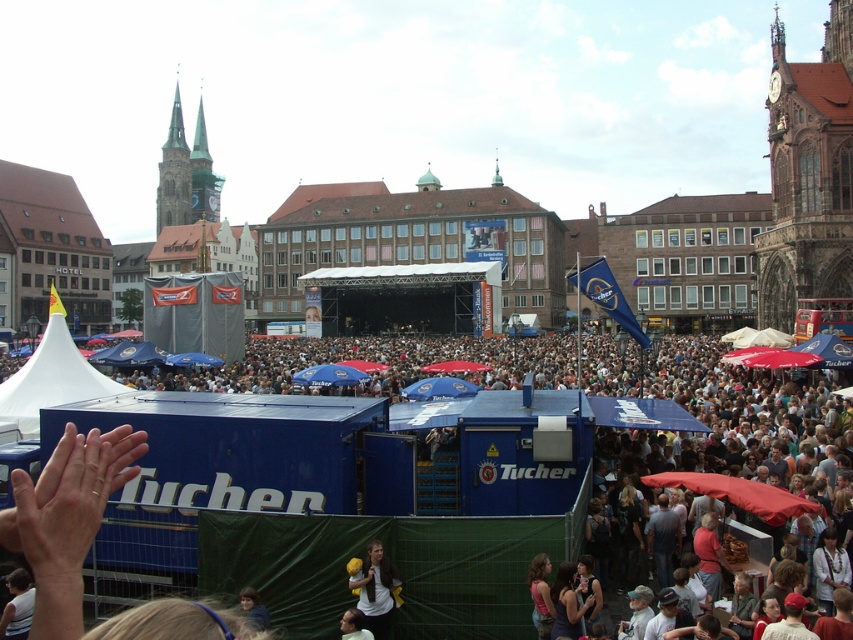
You are a photographer standing at the camera position in the town square. You want to capture a photo of the brown leather jacket at lower center. Is the distance between you and the jacket sufficient to take a clear photo with your standard zoom lens?

The distance between the photographer at the camera and the brown leather jacket at lower center is 50.07 meters. A standard zoom lens typically has a maximum effective focal length of around 200mm, which can capture clear images up to 50 meters away. Therefore, the photographer can take a clear photo of the brown leather jacket at lower center with their standard zoom lens.

You are a photographer standing at the edge of the town square, aiming to capture a wide shot of the event. You notice the brown leather jacket at lower center and the blue fabric umbrella at center. Given their distance apart, will you be able to include both in a single frame without zooming in? Explain your reasoning.

The brown leather jacket at lower center and blue fabric umbrella at center are 122.00 feet apart. Since 122 feet is a considerable distance, it is likely possible to fit both in a single frame without zooming in, provided the photographer uses a wide enough lens to capture the entire scene.

You are a photographer trying to capture a group photo of attendees at the event. You notice a brown leather jacket at lower center and a smooth skin face at lower center in your frame. Based on their sizes, which object would appear wider in the photo?

The brown leather jacket at lower center would appear wider in the photo since its width is larger than the smooth skin face at lower center according to the description.